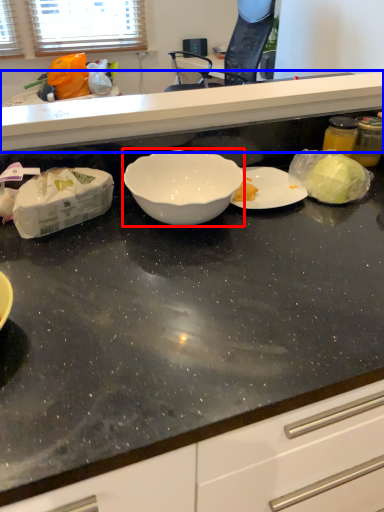
Question: Which point is closer to the camera, bowl (highlighted by a red box) or countertop (highlighted by a blue box)?

Choices:
 (A) bowl
 (B) countertop

Answer: (A)